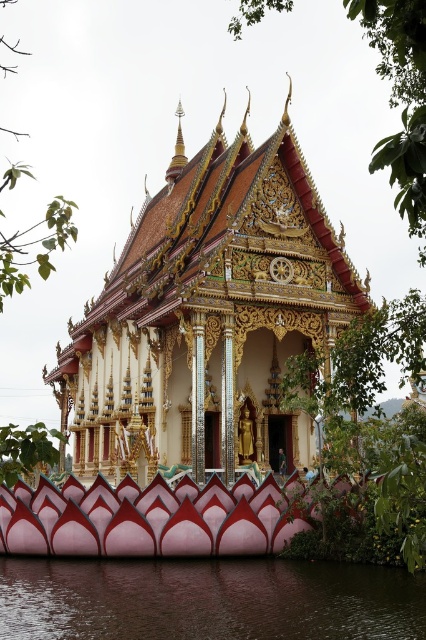
Question: Which object appears closest to the camera in this image?

Choices:
 (A) gold/gilded wood palace at center
 (B) brown smooth water at lower center

Answer: (B)

Question: Can you confirm if gold/gilded wood palace at center is bigger than brown smooth water at lower center?

Choices:
 (A) yes
 (B) no

Answer: (A)

Question: In this image, where is gold/gilded wood palace at center located relative to brown smooth water at lower center?

Choices:
 (A) above
 (B) below

Answer: (A)

Question: Can you confirm if gold/gilded wood palace at center is positioned below brown smooth water at lower center?

Choices:
 (A) yes
 (B) no

Answer: (B)